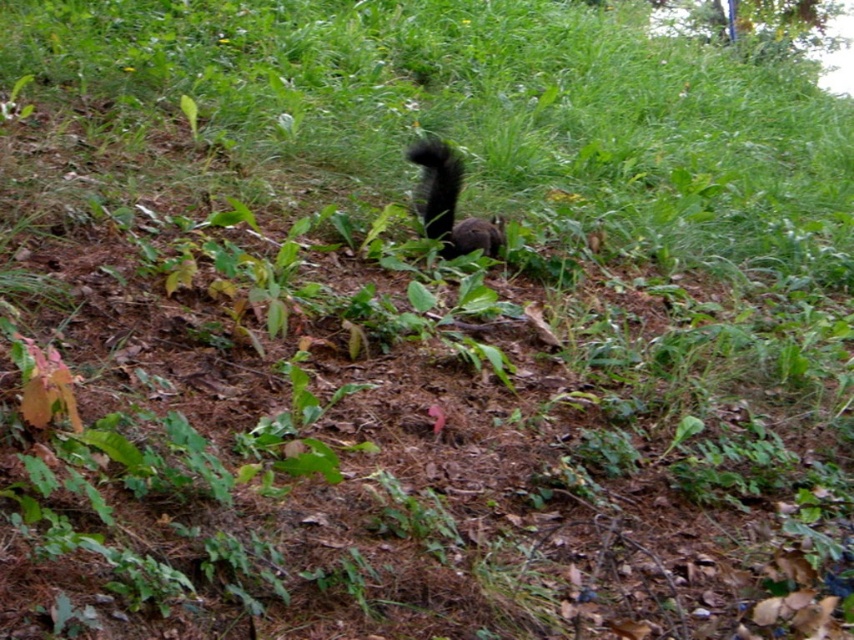
You are a nature photographer observing the scene. You notice the black furry squirrel at center and its black fuzzy tail at center. Which part of the squirrel is taller in the image?

The black furry squirrel at center is much taller than the black fuzzy tail at center.

You are observing a squirrel in a natural outdoor setting. You notice the black furry squirrel at center and its black fuzzy tail at center. Which part of the squirrel is closer to you?

The black furry squirrel at center is closer to the viewer than the black fuzzy tail at center.

You are a nature photographer aiming to capture the black furry squirrel at center and the black fuzzy tail at center in a single frame. Based on their sizes, which one would appear wider in your photo?

The black furry squirrel at center is wider than the black fuzzy tail at center, so it would appear wider in the photo.